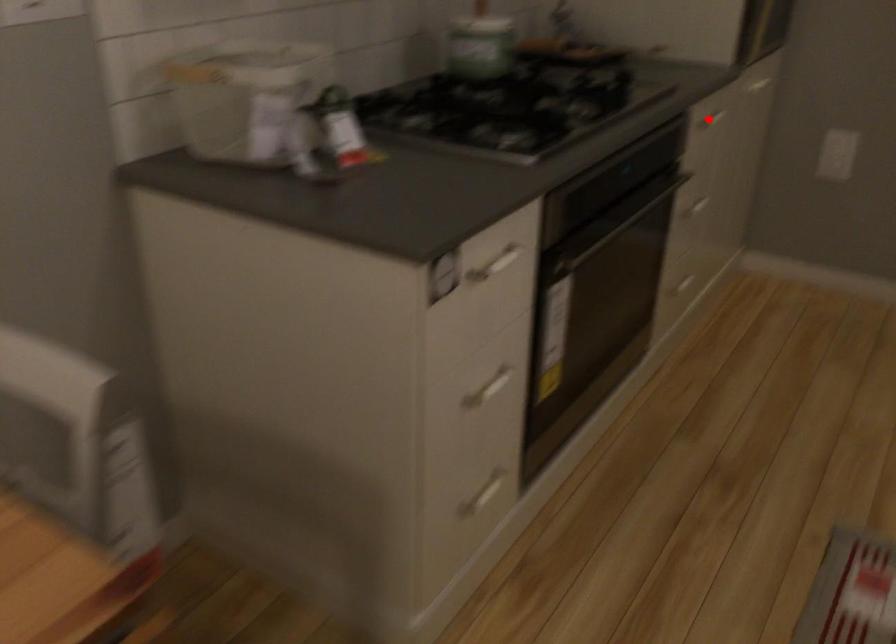
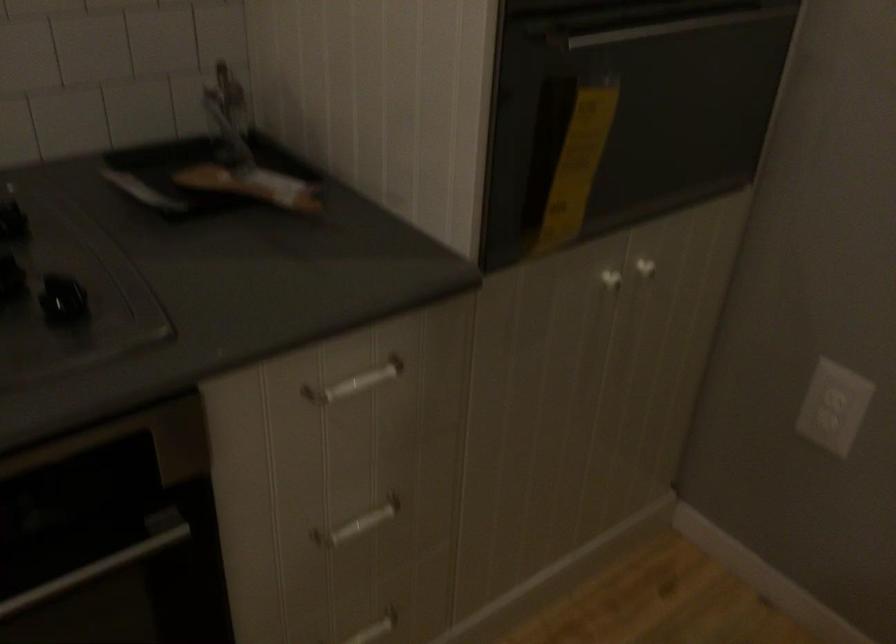
Where in the second image is the point corresponding to the highlighted location from the first image?

(355, 383)